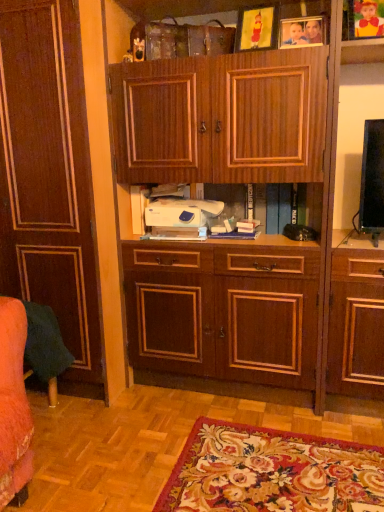
Question: Considering the relative sizes of yellow paper picture frame at upper center, which is counted as the first picture frame, starting from the left, and wooden picture frame at upper center, positioned as the second picture frame in left-to-right order, in the image provided, is yellow paper picture frame at upper center, which is counted as the first picture frame, starting from the left, bigger than wooden picture frame at upper center, positioned as the second picture frame in left-to-right order,?

Choices:
 (A) yes
 (B) no

Answer: (A)

Question: Is yellow paper picture frame at upper center, which is counted as the first picture frame, starting from the left, outside of wooden picture frame at upper center, positioned as the second picture frame in left-to-right order?

Choices:
 (A) yes
 (B) no

Answer: (A)

Question: Would you say yellow paper picture frame at upper center, which is counted as the first picture frame, starting from the left, contains wooden picture frame at upper center, arranged as the second picture frame when viewed from the right?

Choices:
 (A) yes
 (B) no

Answer: (B)

Question: Does yellow paper picture frame at upper center, the 3th picture frame when ordered from right to left, have a greater width compared to wooden picture frame at upper center, arranged as the second picture frame when viewed from the right?

Choices:
 (A) yes
 (B) no

Answer: (A)

Question: Is yellow paper picture frame at upper center, which is counted as the first picture frame, starting from the left, behind wooden picture frame at upper center, arranged as the second picture frame when viewed from the right?

Choices:
 (A) yes
 (B) no

Answer: (B)

Question: In terms of height, does white plastic printer at center look taller or shorter compared to yellow paper picture frame at upper center, the 3th picture frame when ordered from right to left?

Choices:
 (A) short
 (B) tall

Answer: (A)

Question: From a real-world perspective, relative to yellow paper picture frame at upper center, which is counted as the first picture frame, starting from the left, is white plastic printer at center vertically above or below?

Choices:
 (A) below
 (B) above

Answer: (A)

Question: Looking at their shapes, would you say white plastic printer at center is wider or thinner than yellow paper picture frame at upper center, which is counted as the first picture frame, starting from the left?

Choices:
 (A) wide
 (B) thin

Answer: (A)

Question: Is white plastic printer at center situated inside yellow paper picture frame at upper center, which is counted as the first picture frame, starting from the left, or outside?

Choices:
 (A) inside
 (B) outside

Answer: (B)

Question: From a real-world perspective, is yellow paper picture frame at upper center, the 3th picture frame when ordered from right to left, above or below wooden picture frame at upper center, positioned as the second picture frame in left-to-right order?

Choices:
 (A) below
 (B) above

Answer: (B)

Question: Is yellow paper picture frame at upper center, the 3th picture frame when ordered from right to left, wider or thinner than wooden picture frame at upper center, positioned as the second picture frame in left-to-right order?

Choices:
 (A) thin
 (B) wide

Answer: (B)

Question: In the image, is yellow paper picture frame at upper center, which is counted as the first picture frame, starting from the left, on the left side or the right side of wooden picture frame at upper center, positioned as the second picture frame in left-to-right order?

Choices:
 (A) right
 (B) left

Answer: (B)

Question: Considering the positions of point pos(248,37) and point pos(284,26), is point pos(248,37) closer or farther from the camera than point pos(284,26)?

Choices:
 (A) closer
 (B) farther

Answer: (A)

Question: Does point (261, 14) appear closer or farther from the camera than point (352, 3)?

Choices:
 (A) farther
 (B) closer

Answer: (A)

Question: In terms of width, does yellow paper picture frame at upper center, which is counted as the first picture frame, starting from the left, look wider or thinner when compared to wooden picture frame at upper right, which appears as the 3th picture frame when viewed from the left?

Choices:
 (A) wide
 (B) thin

Answer: (B)